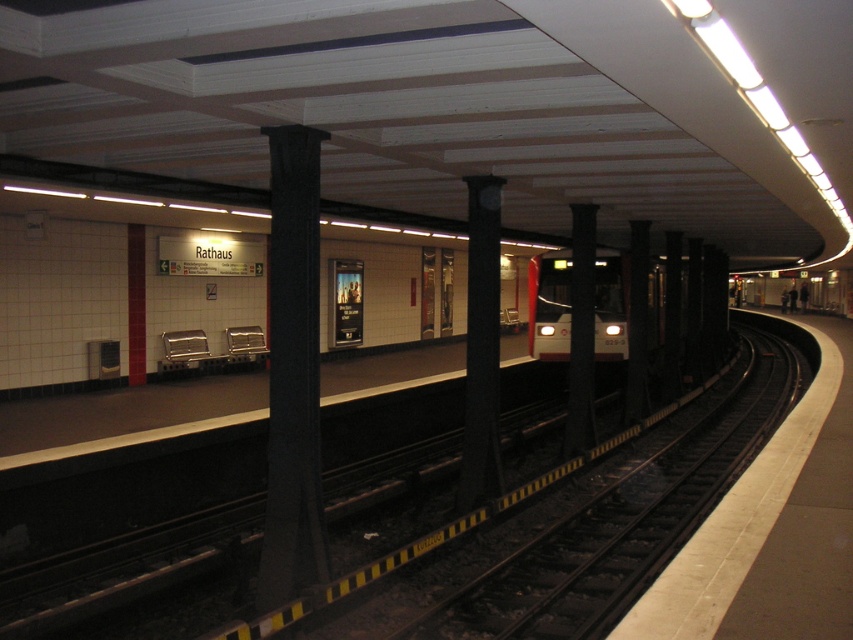
Question: Based on their relative distances, which object is nearer to the black polished pillar at center?

Choices:
 (A) black concrete pillar at center
 (B) white glossy train at center
 (C) black metal track at center

Answer: (A)

Question: Can you confirm if black concrete pillar at center is positioned to the left of white glossy train at center?

Choices:
 (A) no
 (B) yes

Answer: (B)

Question: Which is nearer to the black polished pillar at center?

Choices:
 (A) black metal track at center
 (B) white glossy train at center
 (C) black concrete pillar at center

Answer: (C)

Question: Can you confirm if black concrete pillar at center is positioned to the right of black polished pillar at center?

Choices:
 (A) no
 (B) yes

Answer: (A)

Question: Among these points, which one is farthest from the camera?

Choices:
 (A) (45, 577)
 (B) (474, 316)
 (C) (287, 348)

Answer: (B)

Question: Considering the relative positions of black polished pillar at center and white glossy train at center in the image provided, where is black polished pillar at center located with respect to white glossy train at center?

Choices:
 (A) above
 (B) below

Answer: (B)